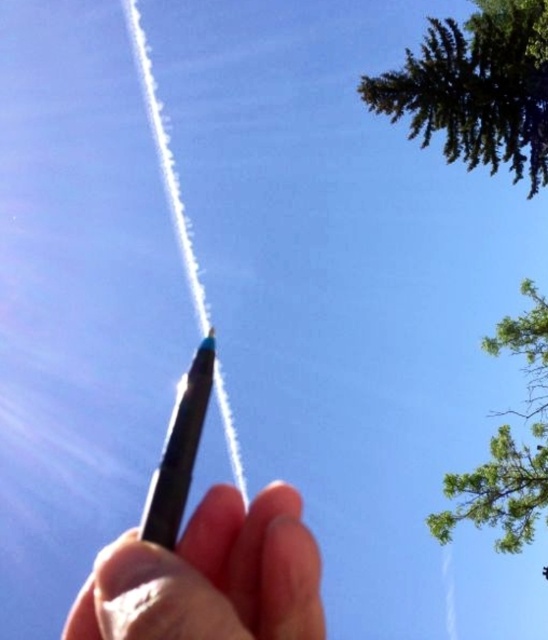
You are an artist sketching outdoors and notice both the green leafy tree at upper right and the black matte pen at center. Which object is closer to your viewpoint?

The green leafy tree at upper right is closer to your viewpoint because the black matte pen at center is behind it.

Consider the image. You are standing in a park and see a hand holding a pen in the bottom left corner of your view. There is also a point in the sky at coordinates [482,125]. If you want to take a closer look at that point, should you move towards the pen or away from it?

The point at coordinates [482,125] is 21.63 meters away from the camera. To get closer to it, you should move towards the pen since both the pen and the point are within your field of view, and moving towards the pen would adjust your position to focus on the point in the sky.